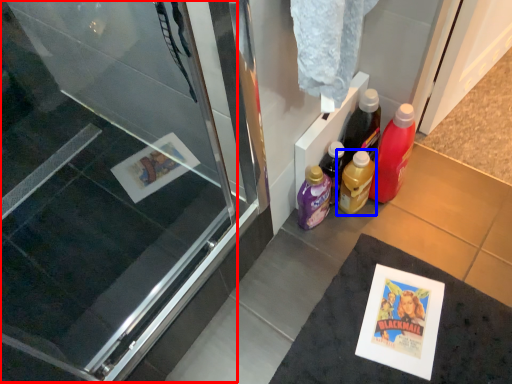
Question: Which of the following is the closest to the observer, screen door (highlighted by a red box) or bottle (highlighted by a blue box)?

Choices:
 (A) screen door
 (B) bottle

Answer: (A)